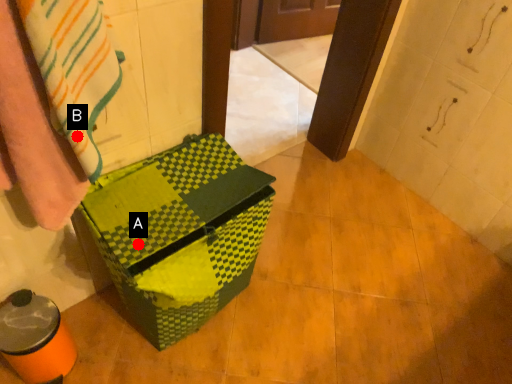
Question: Two points are circled on the image, labeled by A and B beside each circle. Which of the following is the closest to the observer?

Choices:
 (A) A is closer
 (B) B is closer

Answer: (B)